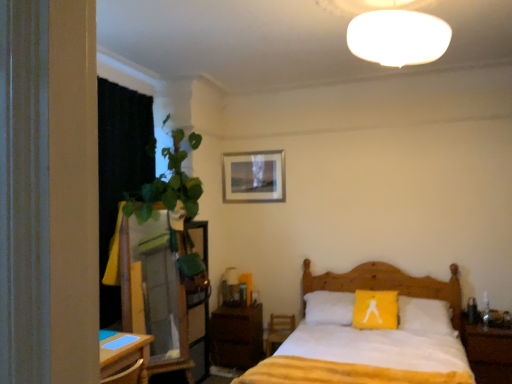
Question: Is matte glass table lamp at center inside the boundaries of black fabric curtain at left, or outside?

Choices:
 (A) outside
 (B) inside

Answer: (A)

Question: From a real-world perspective, is matte glass table lamp at center above or below black fabric curtain at left?

Choices:
 (A) above
 (B) below

Answer: (B)

Question: Which object is positioned closest to the white soft bedsheet at lower center?

Choices:
 (A) matte glass table lamp at center
 (B) black fabric curtain at left
 (C) gold-framed picture at upper center
 (D) white soft bed at center
 (E) wooden armchair at lower center

Answer: (D)

Question: Based on their relative distances, which object is farther from the wooden armchair at lower center?

Choices:
 (A) wooden nightstand at right, the second nightstand in the back-to-front sequence
 (B) white soft bedsheet at lower center
 (C) black fabric curtain at left
 (D) wooden dresser at left
 (E) matte glass table lamp at center

Answer: (C)